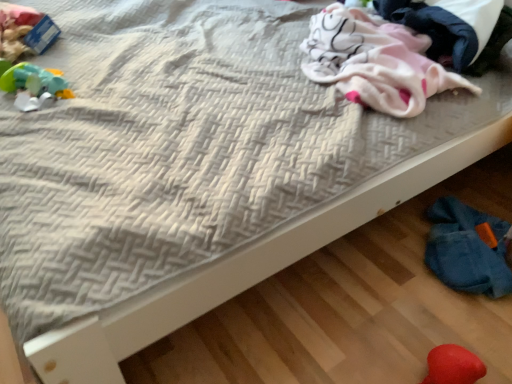
Question: Is point (458, 67) closer or farther from the camera than point (37, 79)?

Choices:
 (A) closer
 (B) farther

Answer: (A)

Question: In terms of height, does pink soft fabric at upper right look taller or shorter compared to rubberized green toy at left, acting as the 2th toy starting from the front?

Choices:
 (A) tall
 (B) short

Answer: (A)

Question: Estimate the real-world distances between objects in this image. Which object is closer to the pink fleece blanket at upper right?

Choices:
 (A) fuzzy red heart at lower right, the second toy when ordered from left to right
 (B) rubberized green toy at left, acting as the 2th toy starting from the front
 (C) pink soft fabric at upper right

Answer: (C)

Question: Which is farther from the fuzzy red heart at lower right, the 1th toy positioned from the bottom?

Choices:
 (A) rubberized green toy at left, which is the first toy from back to front
 (B) pink fleece blanket at upper right
 (C) pink soft fabric at upper right

Answer: (A)